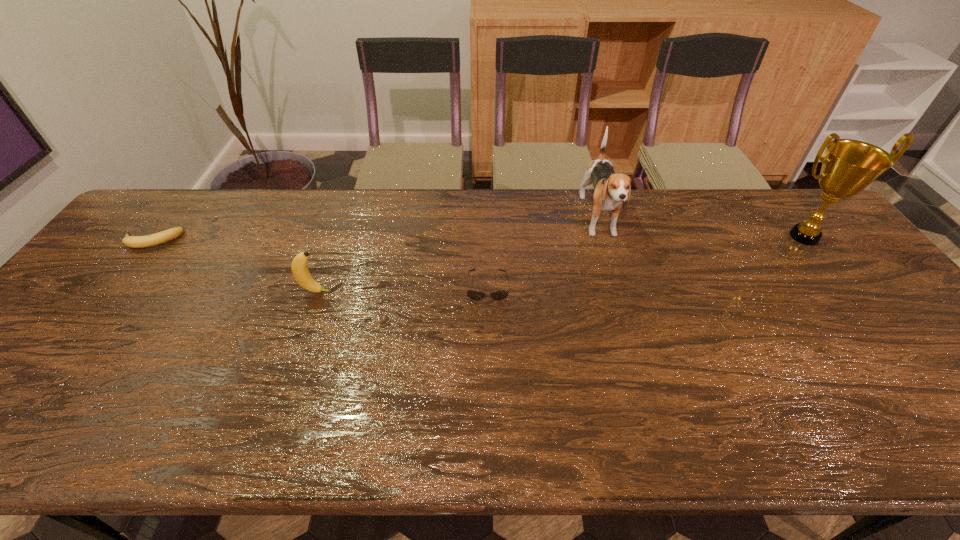
Image resolution: width=960 pixels, height=540 pixels. I want to click on vacant area situated at the face of the puppy, so tap(620, 293).

Identify the location of free space located 0.070m from the stem of the nearer banana. (359, 292).

This screenshot has height=540, width=960. Identify the location of blank space located on the front-facing side of the third object from right to left. (488, 321).

Where is `free space located 0.260m on the front of the shorter banana`? This screenshot has width=960, height=540. free space located 0.260m on the front of the shorter banana is located at coordinates (86, 322).

The height and width of the screenshot is (540, 960). What are the coordinates of `award that is at the far edge` in the screenshot? It's located at (848, 166).

Find the location of a particular element. puppy at the far edge is located at coordinates (611, 189).

You are a GUI agent. You are given a task and a screenshot of the screen. Output one action in this format:
    pyautogui.click(x=<x>, y=<y>)
    Task: Click on the banana positioned at the far edge
    Image resolution: width=960 pixels, height=540 pixels.
    Given the screenshot: What is the action you would take?
    pyautogui.click(x=152, y=240)

Where is `object that is at the left edge`? The width and height of the screenshot is (960, 540). object that is at the left edge is located at coordinates (152, 240).

Find the location of `object at the right edge`. object at the right edge is located at coordinates (848, 166).

The image size is (960, 540). What are the coordinates of `object that is positioned at the far left corner` in the screenshot? It's located at (152, 240).